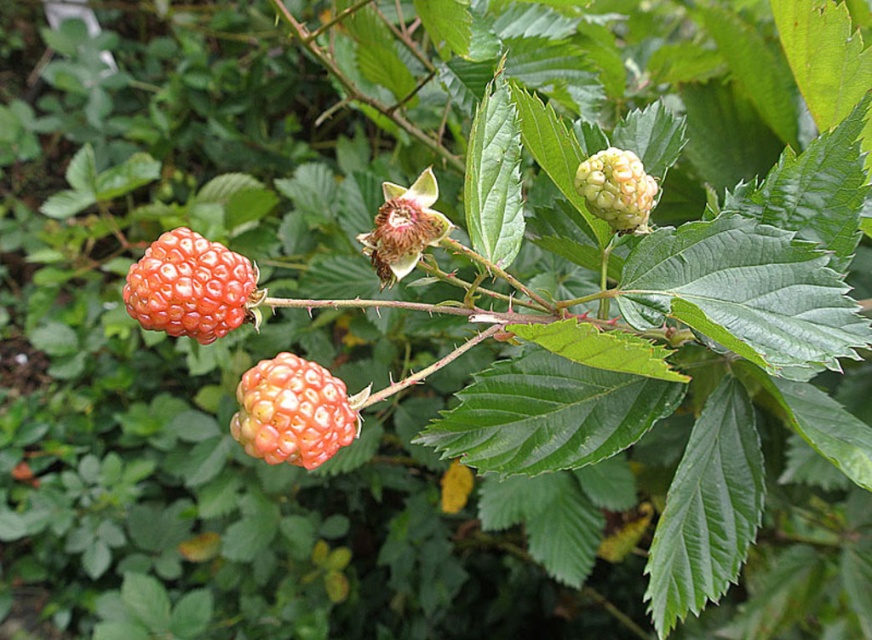
Question: Estimate the real-world distances between objects in this image. Which object is closer to the matte yellow berry at upper right?

Choices:
 (A) orange matte berry at center
 (B) ripe red raspberry at center

Answer: (A)

Question: Which of these objects is positioned farthest from the orange matte berry at center?

Choices:
 (A) ripe red raspberry at center
 (B) matte yellow berry at upper right

Answer: (B)

Question: Which object is positioned closest to the ripe red raspberry at center?

Choices:
 (A) matte yellow berry at upper right
 (B) orange matte berry at center

Answer: (B)

Question: Is ripe red raspberry at center thinner than matte yellow berry at upper right?

Choices:
 (A) no
 (B) yes

Answer: (A)

Question: Is orange matte berry at center closer to the viewer compared to matte yellow berry at upper right?

Choices:
 (A) yes
 (B) no

Answer: (A)

Question: Is orange matte berry at center above matte yellow berry at upper right?

Choices:
 (A) yes
 (B) no

Answer: (B)